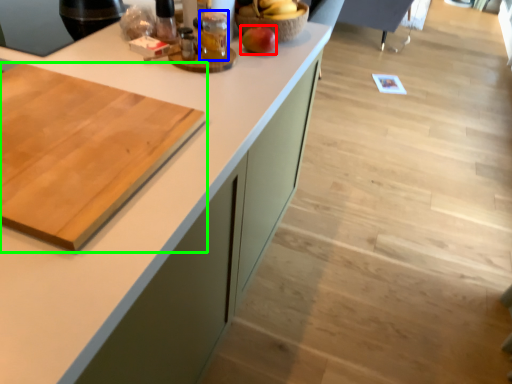
Question: Based on their relative distances, which object is nearer to apple (highlighted by a red box)? Choose from beverage (highlighted by a blue box) and cutting board (highlighted by a green box).

Choices:
 (A) beverage
 (B) cutting board

Answer: (A)